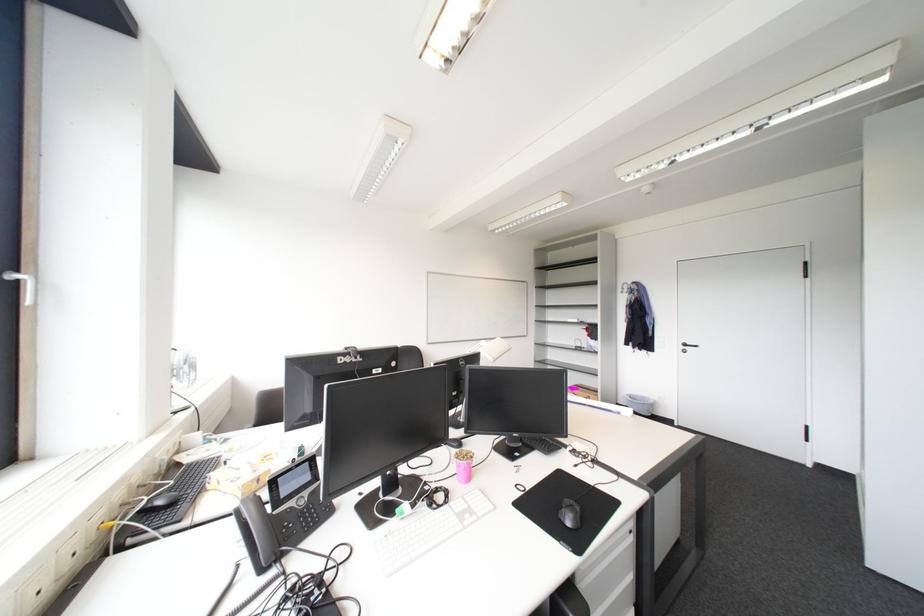
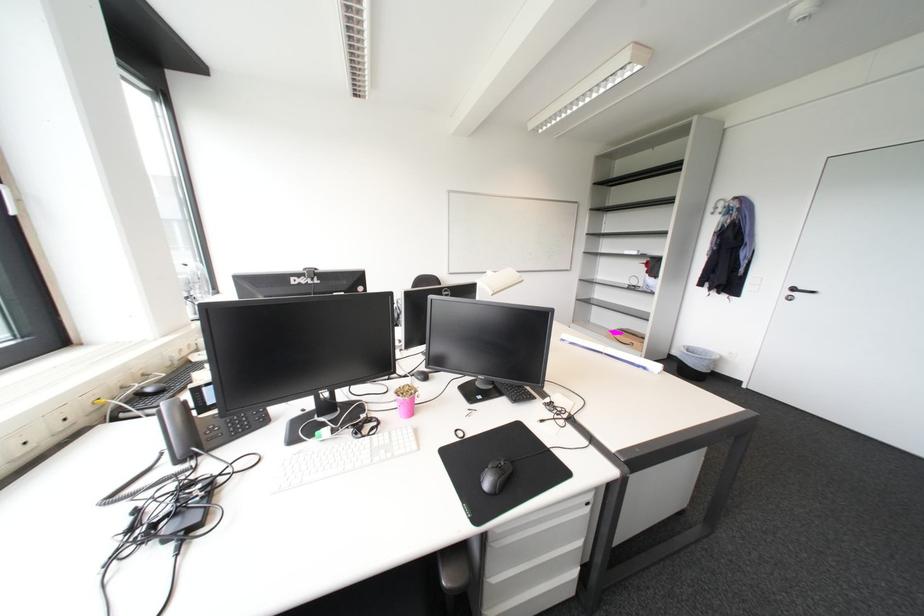
Where in the second image is the point corresponding to [456,504] from the first image?

(379, 436)